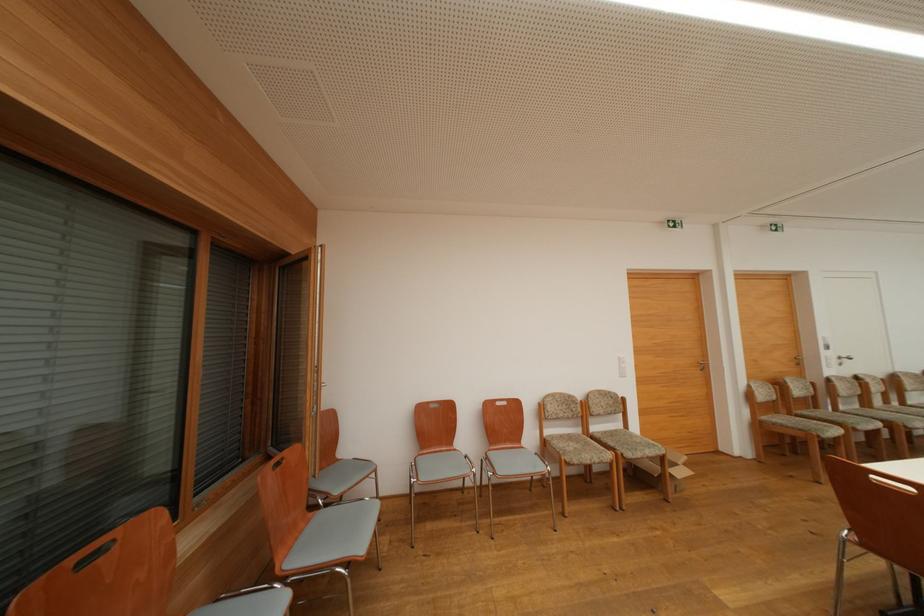
Find where to lift the cardboard box. Please return your answer as a coordinate pair (x, y).

(662, 469)